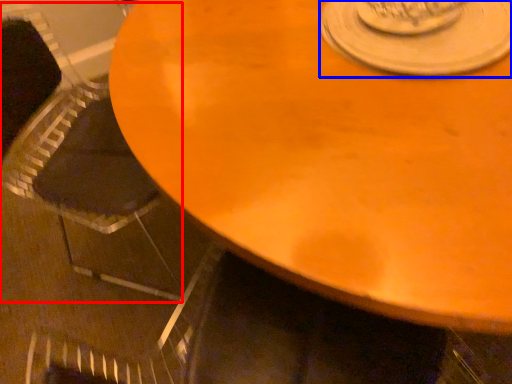
Question: Among these objects, which one is nearest to the camera, armchair (highlighted by a red box) or saucer (highlighted by a blue box)?

Choices:
 (A) armchair
 (B) saucer

Answer: (B)